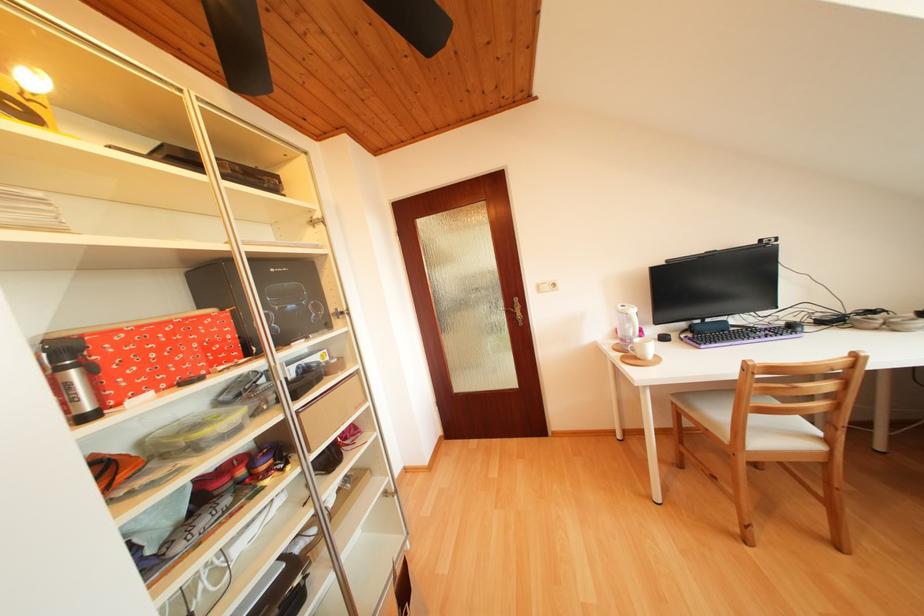
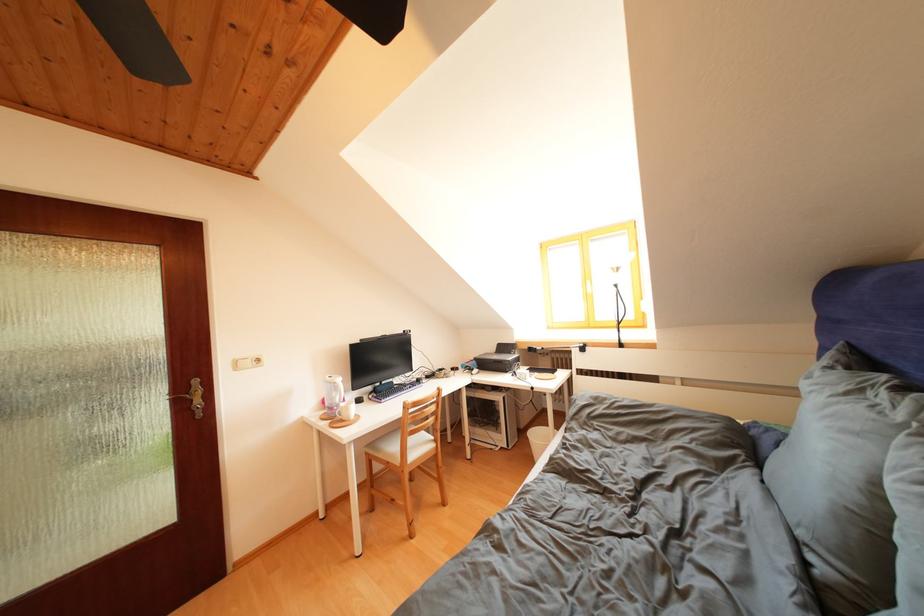
Find the pixel in the second image that matches pixel 636 331 in the first image.

(342, 399)